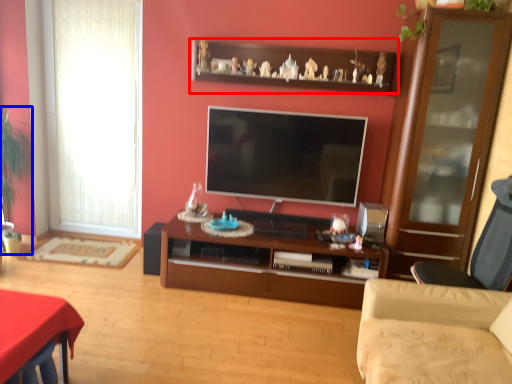
Question: Which point is closer to the camera, shelf (highlighted by a red box) or plant (highlighted by a blue box)?

Choices:
 (A) shelf
 (B) plant

Answer: (A)